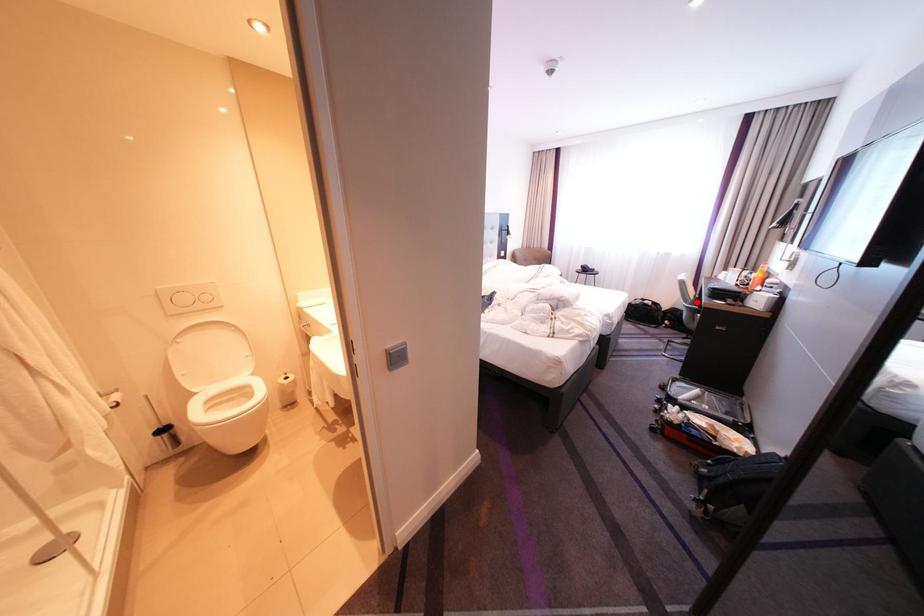
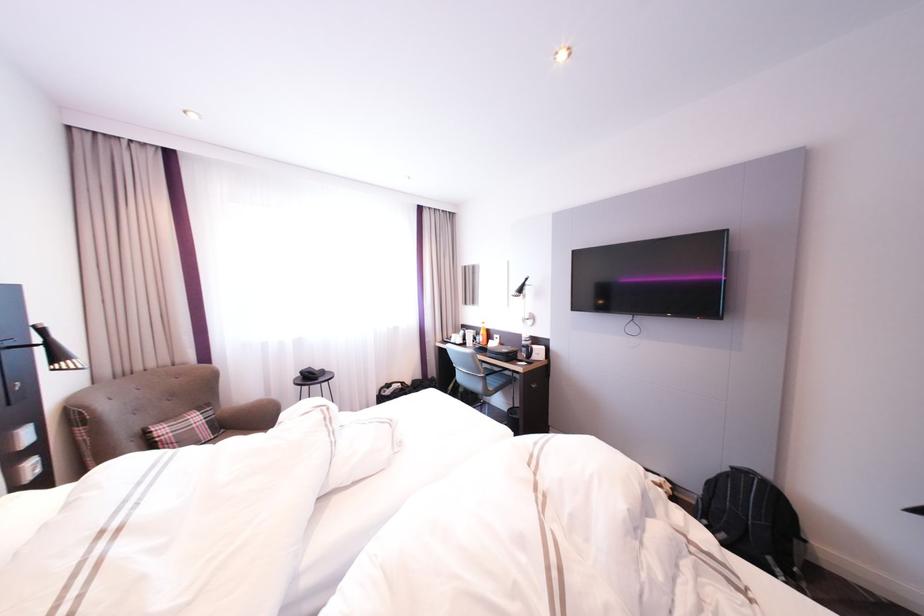
The point at the highlighted location is marked in the first image. Where is the corresponding point in the second image?

(492, 373)